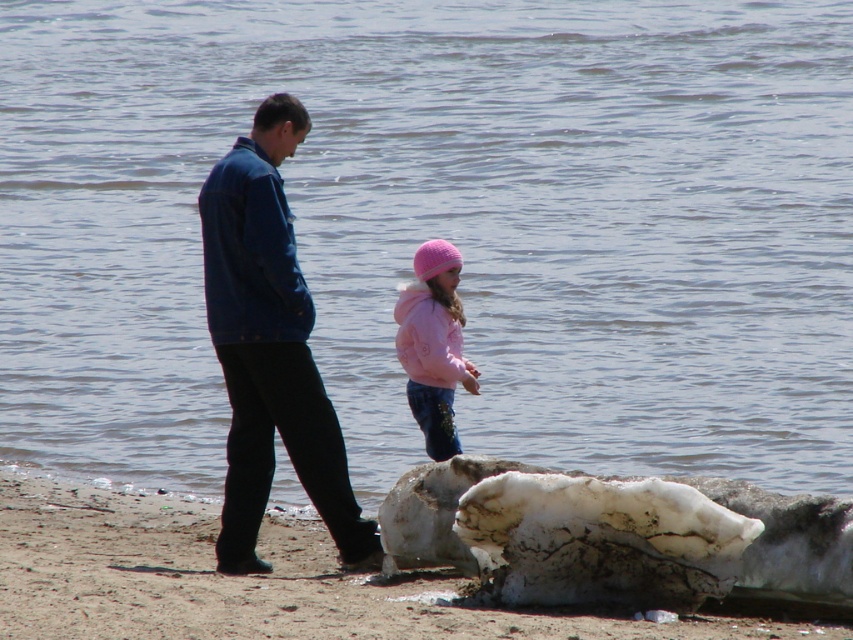
You are a photographer trying to capture both the blue denim jacket at center and the pink fleece jacket at center in a single frame. Given that your camera has a fixed focus range of 1.5 meters, can you fit both jackets in the frame without moving the camera?

The blue denim jacket at center is wider than the pink fleece jacket at center. Since the camera has a fixed focus range of 1.5 meters, it depends on the total width of both jackets combined. If their combined width is less than 1.5 meters, they can fit. However, the exact dimensions aren

You are standing at the center of the beach scene. Which object is closer to your current position, the smooth sand at lower left or the ice or snow in the foreground?

The ice or snow in the foreground is closer to your current position than the smooth sand at lower left.

Looking at this image, you are a photographer planning to take a portrait of the two people in the beach scene. You want to ensure that the smooth sand at lower left and the pink fleece jacket at center are both visible in the frame. Based on their widths, which object should you focus on to ensure both are captured adequately?

The smooth sand at lower left has a lesser width compared to the pink fleece jacket at center. To ensure both are captured adequately, focus on the pink fleece jacket at center since it is wider and requires more space in the frame.